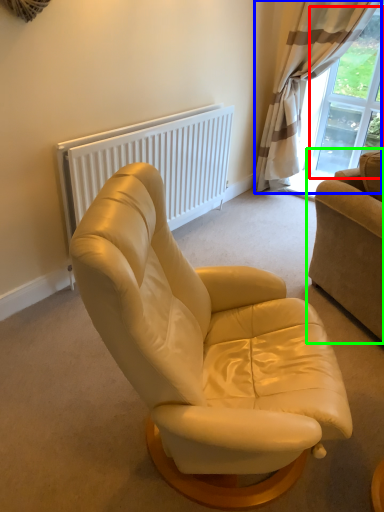
Question: Considering the real-world distances, which object is closest to window screen (highlighted by a red box)? curtain (highlighted by a blue box) or studio couch (highlighted by a green box).

Choices:
 (A) curtain
 (B) studio couch

Answer: (A)